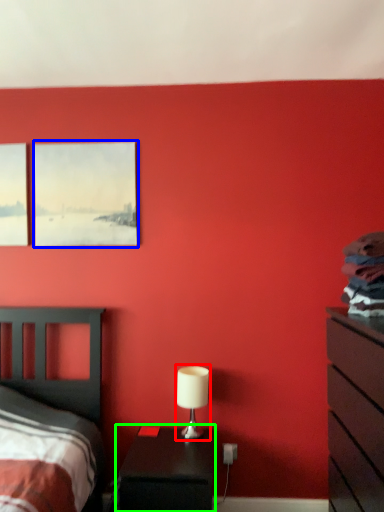
Question: Considering the real-world distances, which object is farthest from table lamp (highlighted by a red box)? picture frame (highlighted by a blue box) or nightstand (highlighted by a green box)?

Choices:
 (A) picture frame
 (B) nightstand

Answer: (A)